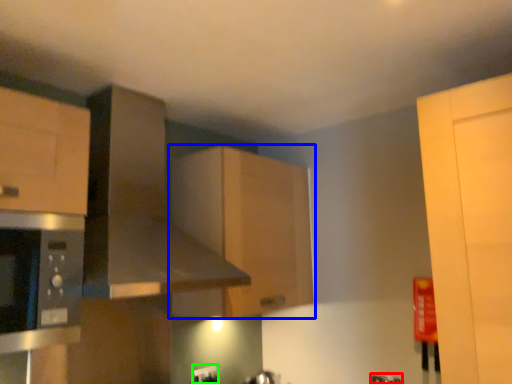
Question: Which object is positioned closest to faucet (highlighted by a red box)? Select from cabinetry (highlighted by a blue box) and electric outlet (highlighted by a green box).

Choices:
 (A) cabinetry
 (B) electric outlet

Answer: (B)